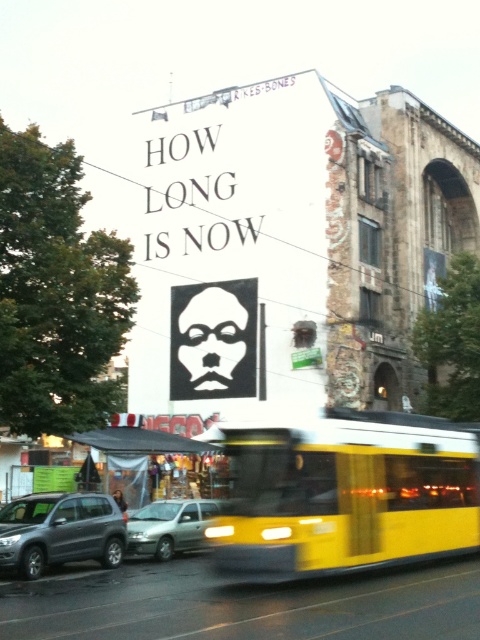
Is matte gray suv at left above silver metallic hatchback at center?

Yes.

Between point (28, 506) and point (160, 524), which one is positioned behind?

Point (160, 524)

Which is behind, point (61, 499) or point (154, 529)?

The point (154, 529) is behind.

You are a GUI agent. You are given a task and a screenshot of the screen. Output one action in this format:
    pyautogui.click(x=<x>, y=<y>)
    Task: Click on the matte gray suv at left
    This screenshot has height=640, width=480.
    Given the screenshot: What is the action you would take?
    pyautogui.click(x=60, y=531)

Image resolution: width=480 pixels, height=640 pixels. What do you see at coordinates (345, 492) in the screenshot?
I see `yellow matte bus at center` at bounding box center [345, 492].

Does yellow matte bus at center have a lesser height compared to silver metallic hatchback at center?

No.

Does point (243, 506) lie in front of point (196, 547)?

Yes, point (243, 506) is in front of point (196, 547).

This screenshot has width=480, height=640. Find the location of `yellow matte bus at center`. yellow matte bus at center is located at coordinates (345, 492).

In the scene shown: Which is below, yellow matte bus at center or matte gray suv at left?

Positioned lower is matte gray suv at left.

Is point (252, 483) more distant than point (98, 502)?

No, (252, 483) is closer to viewer.

You are a GUI agent. You are given a task and a screenshot of the screen. Output one action in this format:
    pyautogui.click(x=<x>, y=<y>)
    Task: Click on the yellow matte bus at center
    The height and width of the screenshot is (640, 480).
    Given the screenshot: What is the action you would take?
    pyautogui.click(x=345, y=492)